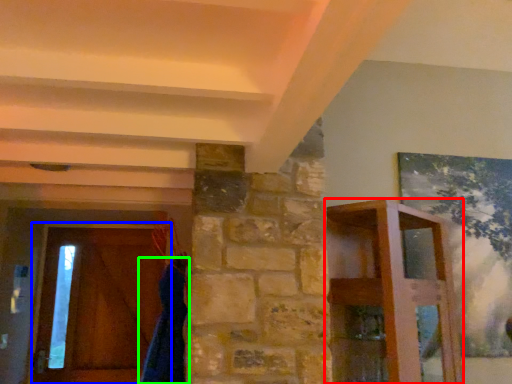
Question: Which object is positioned closest to furniture (highlighted by a red box)? Select from barn door (highlighted by a blue box) and robe (highlighted by a green box).

Choices:
 (A) barn door
 (B) robe

Answer: (B)